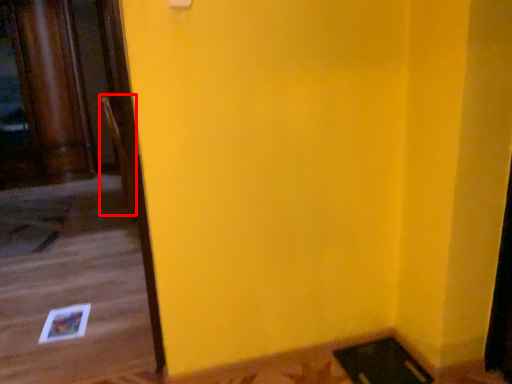
Question: Observing the image, what is the correct spatial positioning of chair (annotated by the red box) in reference to doormat?

Choices:
 (A) left
 (B) right

Answer: (B)